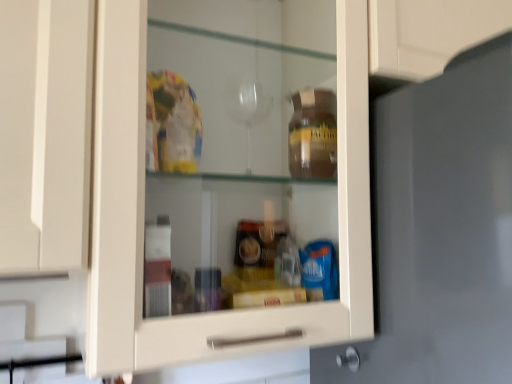
What is the approximate height of metallic silver knob at lower right?

It is 1.60 inches.

Locate an element on the screen. metallic silver knob at lower right is located at coordinates (349, 359).

This screenshot has height=384, width=512. Describe the element at coordinates (349, 359) in the screenshot. I see `metallic silver knob at lower right` at that location.

Describe the element at coordinates (441, 229) in the screenshot. I see `matte gray door at center` at that location.

Find the location of a particular element. The image size is (512, 384). matte gray door at center is located at coordinates (441, 229).

Locate an element on the screen. metallic silver knob at lower right is located at coordinates (349, 359).

Considering the positions of objects metallic silver knob at lower right and matte gray door at center in the image provided, who is more to the left, metallic silver knob at lower right or matte gray door at center?

metallic silver knob at lower right is more to the left.

Which object is closer to the camera taking this photo, metallic silver knob at lower right or matte gray door at center?

matte gray door at center is more forward.

Does point (339, 364) come farther from viewer compared to point (432, 342)?

That is True.

From the image's perspective, is metallic silver knob at lower right above matte gray door at center?

Incorrect, from the image's perspective, metallic silver knob at lower right is lower than matte gray door at center.

From a real-world perspective, which is physically above, metallic silver knob at lower right or matte gray door at center?

In real-world perspective, matte gray door at center is above.

Considering the sizes of metallic silver knob at lower right and matte gray door at center in the image, is metallic silver knob at lower right wider or thinner than matte gray door at center?

Clearly, metallic silver knob at lower right has less width compared to matte gray door at center.

Looking at this image, considering the sizes of objects metallic silver knob at lower right and matte gray door at center in the image provided, who is shorter, metallic silver knob at lower right or matte gray door at center?

metallic silver knob at lower right is shorter.

Considering the relative sizes of metallic silver knob at lower right and matte gray door at center in the image provided, is metallic silver knob at lower right smaller than matte gray door at center?

Correct, metallic silver knob at lower right occupies less space than matte gray door at center.

Is metallic silver knob at lower right inside the boundaries of matte gray door at center, or outside?

metallic silver knob at lower right is enclosed within matte gray door at center.

Can you see metallic silver knob at lower right touching matte gray door at center?

metallic silver knob at lower right is not next to matte gray door at center, and they're not touching.

Consider the image. Is metallic silver knob at lower right positioned with its back to matte gray door at center?

That's right, metallic silver knob at lower right is facing away from matte gray door at center.

How different are the orientations of metallic silver knob at lower right and matte gray door at center in degrees?

There is a 86.6-degree angle between the facing directions of metallic silver knob at lower right and matte gray door at center.

Where is `knob that is behind the matte gray door at center`? knob that is behind the matte gray door at center is located at coordinates (349, 359).

Which is more to the left, matte gray door at center or metallic silver knob at lower right?

metallic silver knob at lower right.

Is the depth of matte gray door at center greater than that of metallic silver knob at lower right?

No, matte gray door at center is in front of metallic silver knob at lower right.

Is point (398, 141) positioned behind point (350, 346)?

No, it is not.

Consider the image. From the image's perspective, between matte gray door at center and metallic silver knob at lower right, who is located below?

From the image's view, metallic silver knob at lower right is below.

From a real-world perspective, which object rests below the other?

metallic silver knob at lower right, from a real-world perspective.

Which object is thinner, matte gray door at center or metallic silver knob at lower right?

Thinner between the two is metallic silver knob at lower right.

Between matte gray door at center and metallic silver knob at lower right, which one has more height?

matte gray door at center is taller.

Considering the relative sizes of matte gray door at center and metallic silver knob at lower right in the image provided, is matte gray door at center bigger than metallic silver knob at lower right?

Correct, matte gray door at center is larger in size than metallic silver knob at lower right.

Is matte gray door at center surrounding metallic silver knob at lower right?

Indeed, metallic silver knob at lower right is located within matte gray door at center.

Is matte gray door at center beside metallic silver knob at lower right?

No.

Is matte gray door at center aimed at metallic silver knob at lower right?

No, matte gray door at center is not aimed at metallic silver knob at lower right.

How many degrees apart are the facing directions of matte gray door at center and metallic silver knob at lower right?

They differ by 86.6 degrees in their facing directions.

Identify the location of knob located behind the matte gray door at center. (349, 359).

In order to click on knob on the left of matte gray door at center in this screenshot , I will do `click(349, 359)`.

This screenshot has height=384, width=512. I want to click on door in front of the metallic silver knob at lower right, so click(x=441, y=229).